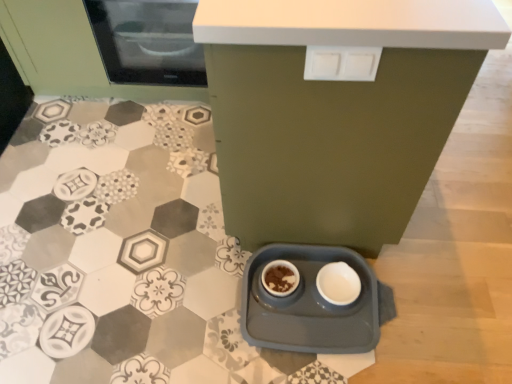
Question: Considering the positions of matte black microwave at upper left and white plastic drawer at upper center in the image, is matte black microwave at upper left taller or shorter than white plastic drawer at upper center?

Choices:
 (A) tall
 (B) short

Answer: (A)

Question: Considering the positions of matte black microwave at upper left and white plastic drawer at upper center in the image, is matte black microwave at upper left wider or thinner than white plastic drawer at upper center?

Choices:
 (A) wide
 (B) thin

Answer: (A)

Question: Which object is the farthest from the matte green cabinet at lower center?

Choices:
 (A) matte black microwave at upper left
 (B) matte ceramic bowl at center
 (C) gray plastic tray at lower center
 (D) white glossy bowl at lower center
 (E) white plastic drawer at upper center

Answer: (A)

Question: Which object is the farthest from the gray plastic tray at lower center?

Choices:
 (A) white plastic drawer at upper center
 (B) white glossy bowl at lower center
 (C) matte green cabinet at lower center
 (D) matte black microwave at upper left
 (E) matte ceramic bowl at center

Answer: (D)